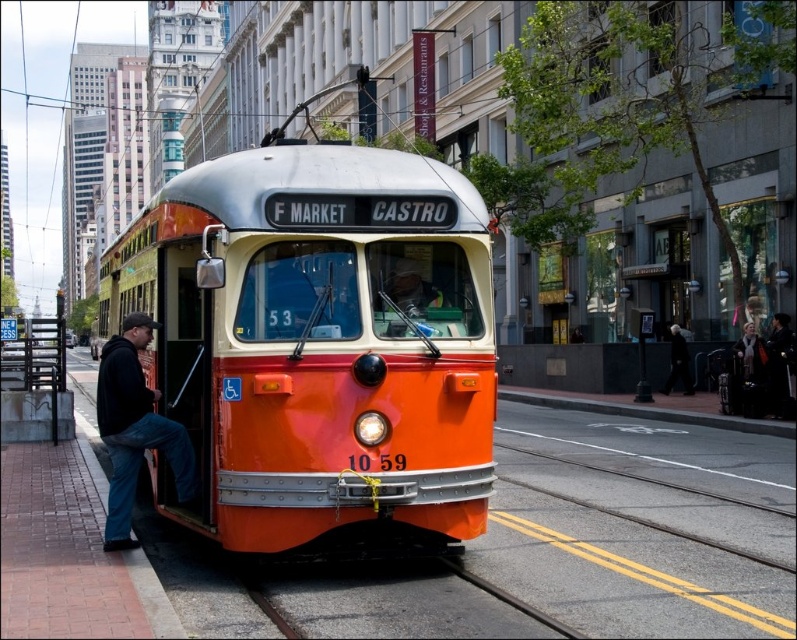
Can you confirm if metallic track at center is shorter than black leather jacket at center?

Indeed, metallic track at center has a lesser height compared to black leather jacket at center.

Does metallic track at center appear on the right side of black leather jacket at center?

Incorrect, metallic track at center is not on the right side of black leather jacket at center.

Between point (457, 573) and point (681, 380), which one is positioned behind?

The point (681, 380) is behind.

At what (x,y) coordinates should I click in order to perform the action: click on metallic track at center. Please return your answer as a coordinate pair (x, y). This screenshot has width=797, height=640. Looking at the image, I should click on (509, 600).

Who is shorter, brushed metal bus stop at lower left or black leather coat at right?

brushed metal bus stop at lower left

In the scene shown: Is brushed metal bus stop at lower left closer to camera compared to black leather coat at right?

Yes, it is in front of black leather coat at right.

Locate an element on the screen. brushed metal bus stop at lower left is located at coordinates (34, 381).

Identify the location of brushed metal bus stop at lower left. This screenshot has width=797, height=640. (34, 381).

Which is more to the right, brushed metal bus stop at lower left or black leather jacket at center?

black leather jacket at center is more to the right.

Who is positioned more to the left, brushed metal bus stop at lower left or black leather jacket at center?

From the viewer's perspective, brushed metal bus stop at lower left appears more on the left side.

The height and width of the screenshot is (640, 797). What are the coordinates of `brushed metal bus stop at lower left` in the screenshot? It's located at (34, 381).

At what (x,y) coordinates should I click in order to perform the action: click on brushed metal bus stop at lower left. Please return your answer as a coordinate pair (x, y). Image resolution: width=797 pixels, height=640 pixels. Looking at the image, I should click on click(x=34, y=381).